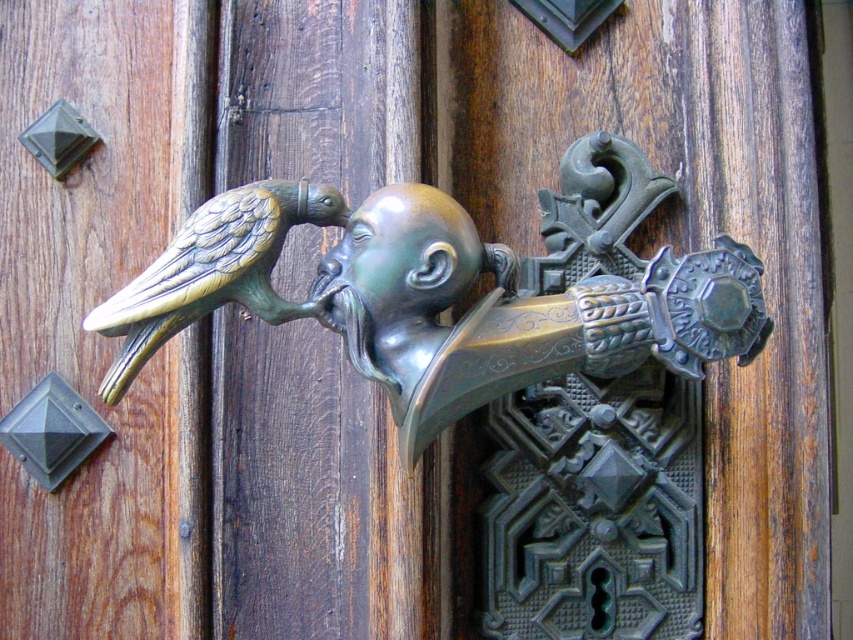
Question: Can you confirm if bronze bird at center is thinner than gold-bronze bird at center-left?

Choices:
 (A) no
 (B) yes

Answer: (A)

Question: Which object appears farthest from the camera in this image?

Choices:
 (A) gold-bronze bird at center-left
 (B) bronze bird at center

Answer: (B)

Question: Which point is farther to the camera?

Choices:
 (A) (x=316, y=212)
 (B) (x=264, y=282)

Answer: (A)

Question: Does bronze bird at center have a greater width compared to gold-bronze bird at center-left?

Choices:
 (A) yes
 (B) no

Answer: (A)

Question: Can you confirm if bronze bird at center is bigger than gold-bronze bird at center-left?

Choices:
 (A) no
 (B) yes

Answer: (B)

Question: Which point is closer to the camera taking this photo?

Choices:
 (A) (438, 337)
 (B) (190, 300)

Answer: (B)